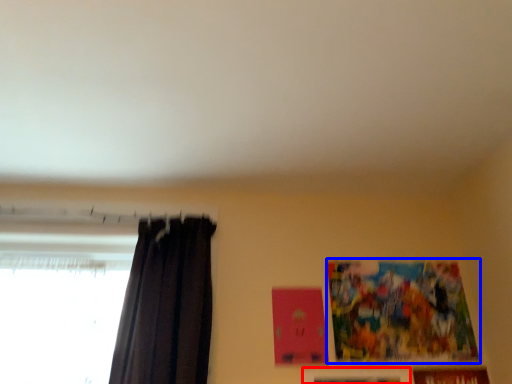
Question: Among these objects, which one is farthest to the camera, picture frame (highlighted by a red box) or picture frame (highlighted by a blue box)?

Choices:
 (A) picture frame
 (B) picture frame

Answer: (B)